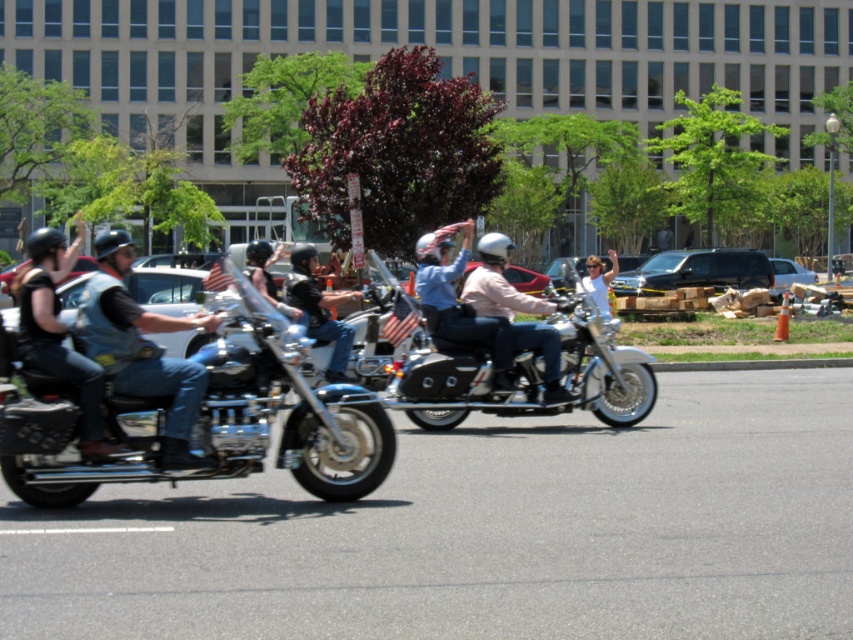
Which is more to the right, matte black motorcycle at left or white shirt at center?

Positioned to the right is white shirt at center.

Does point (33, 294) come in front of point (608, 278)?

Yes, it is in front of point (608, 278).

Identify the location of matte black motorcycle at left. 59,332.

Between shiny chrome motorcycle at left and white shirt at center, which one appears on the right side from the viewer's perspective?

white shirt at center is more to the right.

Between point (374, 432) and point (613, 250), which one is positioned in front?

Positioned in front is point (374, 432).

Is point (230, 300) farther from camera compared to point (614, 259)?

No.

I want to click on shiny chrome motorcycle at left, so click(x=199, y=419).

Consider the image. Which of these two, shiny chrome motorcycle at left or matte pink jacket at center, stands shorter?

shiny chrome motorcycle at left

This screenshot has width=853, height=640. What are the coordinates of `shiny chrome motorcycle at left` in the screenshot? It's located at (199, 419).

Image resolution: width=853 pixels, height=640 pixels. What do you see at coordinates (199, 419) in the screenshot?
I see `shiny chrome motorcycle at left` at bounding box center [199, 419].

Where is `shiny chrome motorcycle at left`? This screenshot has width=853, height=640. shiny chrome motorcycle at left is located at coordinates pos(199,419).